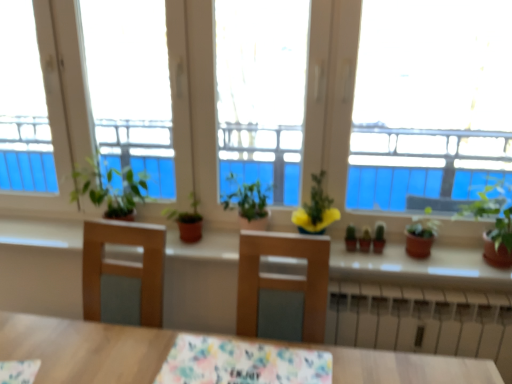
Find the location of a particular element. Image resolution: width=512 pixels, height=384 pixels. green matte plant at center, the 5th houseplant from the right is located at coordinates (187, 221).

Where is `matte brown pot at right, acting as the fourth houseplant starting from the left`? matte brown pot at right, acting as the fourth houseplant starting from the left is located at coordinates (421, 235).

What do you see at coordinates (350, 238) in the screenshot?
I see `green matte cactus at center, the 2th plant viewed from the right` at bounding box center [350, 238].

You are a GUI agent. You are given a task and a screenshot of the screen. Output one action in this format:
    pyautogui.click(x=<x>, y=<y>)
    Task: Click on the yellow matte flower pot at center, the third houseplant when ordered from left to right
    The image size is (512, 384).
    Given the screenshot: What is the action you would take?
    pyautogui.click(x=316, y=210)

Describe the element at coordinates (422, 321) in the screenshot. Image resolution: width=512 pixels, height=384 pixels. I see `white metallic radiator at lower center` at that location.

The width and height of the screenshot is (512, 384). Describe the element at coordinates (420, 268) in the screenshot. I see `beige concrete window sill at center` at that location.

Where is `floral fabric tablecloth at center`? This screenshot has width=512, height=384. floral fabric tablecloth at center is located at coordinates 241,362.

At what (x,y) coordinates should I click in order to perform the action: click on green matte plant at center, the 5th houseplant from the right. Please return your answer as a coordinate pair (x, y). Looking at the image, I should click on (187, 221).

Is white metallic radiator at lower center next to matte brown pot at right, which is the second houseplant from right to left, and touching it?

No.

How distant is white metallic radiator at lower center from matte brown pot at right, which is the second houseplant from right to left?

They are 29.70 centimeters apart.

From the image's perspective, which is below, white metallic radiator at lower center or matte brown pot at right, acting as the fourth houseplant starting from the left?

white metallic radiator at lower center is shown below in the image.

You are a GUI agent. You are given a task and a screenshot of the screen. Output one action in this format:
    pyautogui.click(x=<x>, y=<y>)
    Task: Click on the radiator below the matte brown pot at right, acting as the fourth houseplant starting from the left (from a real-world perspective)
    The width and height of the screenshot is (512, 384).
    Given the screenshot: What is the action you would take?
    pyautogui.click(x=422, y=321)

From the image's perspective, is green matte plant at center, the 5th houseplant from the right, above or below green matte plant at right, the fifth houseplant positioned from the left?

green matte plant at center, the 5th houseplant from the right, is below green matte plant at right, the fifth houseplant positioned from the left.

Starting from the green matte plant at center, the first houseplant when ordered from left to right, which houseplant is the 4th one in front? Please provide its 2D coordinates.

[(494, 225)]

What's the angular difference between green matte plant at center, the 5th houseplant from the right, and green matte plant at right, the fifth houseplant positioned from the left,'s facing directions?

The angular difference between green matte plant at center, the 5th houseplant from the right, and green matte plant at right, the fifth houseplant positioned from the left, is 9.6e-05 degrees.

Looking at this image, considering the relative sizes of green matte plant at center, the first houseplant when ordered from left to right, and green matte plant at right, the fifth houseplant positioned from the left, in the image provided, is green matte plant at center, the first houseplant when ordered from left to right, smaller than green matte plant at right, the fifth houseplant positioned from the left,?

Correct, green matte plant at center, the first houseplant when ordered from left to right, occupies less space than green matte plant at right, the fifth houseplant positioned from the left.

Considering the relative sizes of yellow matte flower pot at center, the third houseplant when ordered from left to right, and green matte plant at right, acting as the first houseplant starting from the right, in the image provided, is yellow matte flower pot at center, the third houseplant when ordered from left to right, wider than green matte plant at right, acting as the first houseplant starting from the right,?

Incorrect, the width of yellow matte flower pot at center, the third houseplant when ordered from left to right, does not surpass that of green matte plant at right, acting as the first houseplant starting from the right.

Is yellow matte flower pot at center, which ranks as the third houseplant in right-to-left order, not within green matte plant at right, the fifth houseplant positioned from the left?

yellow matte flower pot at center, which ranks as the third houseplant in right-to-left order, is positioned outside green matte plant at right, the fifth houseplant positioned from the left.

Based on the photo, from a real-world perspective, which is physically below, yellow matte flower pot at center, which ranks as the third houseplant in right-to-left order, or green matte plant at right, the fifth houseplant positioned from the left?

From a 3D spatial view, yellow matte flower pot at center, which ranks as the third houseplant in right-to-left order, is below.

Between yellow matte flower pot at center, which ranks as the third houseplant in right-to-left order, and green matte plant at right, acting as the first houseplant starting from the right, which one appears on the right side from the viewer's perspective?

Positioned to the right is green matte plant at right, acting as the first houseplant starting from the right.

Which of these two, green matte plant at center, which appears as the 2th plant when viewed from the left, or yellow matte flower pot at center, the third houseplant when ordered from left to right, is smaller?

Smaller between the two is green matte plant at center, which appears as the 2th plant when viewed from the left.

Considering the relative sizes of green matte plant at center, which appears as the 2th plant when viewed from the left, and yellow matte flower pot at center, which ranks as the third houseplant in right-to-left order, in the image provided, is green matte plant at center, which appears as the 2th plant when viewed from the left, wider than yellow matte flower pot at center, which ranks as the third houseplant in right-to-left order,?

Incorrect, the width of green matte plant at center, which appears as the 2th plant when viewed from the left, does not surpass that of yellow matte flower pot at center, which ranks as the third houseplant in right-to-left order.

In terms of height, does green matte plant at center, which is the 1th plant in right-to-left order, look taller or shorter compared to yellow matte flower pot at center, which ranks as the third houseplant in right-to-left order?

Considering their sizes, green matte plant at center, which is the 1th plant in right-to-left order, has less height than yellow matte flower pot at center, which ranks as the third houseplant in right-to-left order.

Between green matte plant at center, which is the 1th plant in right-to-left order, and yellow matte flower pot at center, which ranks as the third houseplant in right-to-left order, which one appears on the left side from the viewer's perspective?

yellow matte flower pot at center, which ranks as the third houseplant in right-to-left order, is more to the left.

Considering the sizes of objects floral fabric tablecloth at center and matte brown pot at right, acting as the fourth houseplant starting from the left, in the image provided, who is bigger, floral fabric tablecloth at center or matte brown pot at right, acting as the fourth houseplant starting from the left,?

floral fabric tablecloth at center.

Which is behind, point (268, 360) or point (428, 229)?

The point (428, 229) is farther.

From a real-world perspective, which object rests below the other?

floral fabric tablecloth at center, from a real-world perspective.

Considering the sizes of objects floral fabric tablecloth at center and matte brown pot at right, acting as the fourth houseplant starting from the left, in the image provided, who is wider, floral fabric tablecloth at center or matte brown pot at right, acting as the fourth houseplant starting from the left,?

Wider between the two is floral fabric tablecloth at center.

Which is correct: beige concrete window sill at center is inside transparent glass window at center, or outside of it?

beige concrete window sill at center is spatially situated outside transparent glass window at center.

Which of these two, beige concrete window sill at center or transparent glass window at center, is wider?

With larger width is beige concrete window sill at center.

Considering the sizes of beige concrete window sill at center and transparent glass window at center in the image, is beige concrete window sill at center taller or shorter than transparent glass window at center?

beige concrete window sill at center is shorter than transparent glass window at center.

Does white metallic radiator at lower center turn towards green matte plant at right, acting as the first houseplant starting from the right?

No, white metallic radiator at lower center is not turned towards green matte plant at right, acting as the first houseplant starting from the right.

Which is behind, point (357, 290) or point (486, 192)?

Positioned behind is point (486, 192).

Is white metallic radiator at lower center at the left side of green matte plant at right, acting as the first houseplant starting from the right?

Correct, you'll find white metallic radiator at lower center to the left of green matte plant at right, acting as the first houseplant starting from the right.

Based on the photo, would you say green matte plant at right, acting as the first houseplant starting from the right, is part of white metallic radiator at lower center's contents?

Answer: That's incorrect, green matte plant at right, acting as the first houseplant starting from the right, is not inside white metallic radiator at lower center.

Locate an element on the screen. The height and width of the screenshot is (384, 512). radiator on the right of the matte brown pot at right, acting as the fourth houseplant starting from the left is located at coordinates (422, 321).

You are a GUI agent. You are given a task and a screenshot of the screen. Output one action in this format:
    pyautogui.click(x=<x>, y=<y>)
    Task: Click on the 1st houseplant below when counting from the green matte plant at right, acting as the first houseplant starting from the right (from the image's perspective)
    This screenshot has width=512, height=384.
    Given the screenshot: What is the action you would take?
    pyautogui.click(x=187, y=221)

From the picture: From the image, which object appears to be farther from matte brown pot at right, which is the second houseplant from right to left, white metallic radiator at lower center or green matte plant at right, acting as the first houseplant starting from the right?

white metallic radiator at lower center lies further to matte brown pot at right, which is the second houseplant from right to left, than the other object.

From the image, which object appears to be farther from white metallic radiator at lower center, green matte plant at center, the first houseplant when ordered from left to right, or green matte plant at center, which is the 4th houseplant in right-to-left order?

green matte plant at center, the first houseplant when ordered from left to right, lies further to white metallic radiator at lower center than the other object.

Considering their positions, is green matte plant at center, which is the 1th plant in right-to-left order, positioned closer to yellow matte flower pot at center, the third houseplant when ordered from left to right, than white metallic radiator at lower center?

The object closer to yellow matte flower pot at center, the third houseplant when ordered from left to right, is green matte plant at center, which is the 1th plant in right-to-left order.

Considering their positions, is green matte cactus at center, marked as the 1th plant in a left-to-right arrangement, positioned further to green matte plant at right, acting as the first houseplant starting from the right, than yellow matte flower pot at center, which ranks as the third houseplant in right-to-left order?

yellow matte flower pot at center, which ranks as the third houseplant in right-to-left order.

Estimate the real-world distances between objects in this image. Which object is further from white metallic radiator at lower center, green matte plant at center, which is the 4th houseplant in right-to-left order, or yellow matte flower pot at center, the third houseplant when ordered from left to right?

Among the two, green matte plant at center, which is the 4th houseplant in right-to-left order, is located further to white metallic radiator at lower center.

Based on their spatial positions, is beige concrete window sill at center or green matte plant at right, the fifth houseplant positioned from the left, closer to green matte cactus at center, marked as the 1th plant in a left-to-right arrangement?

beige concrete window sill at center is positioned closer to the anchor green matte cactus at center, marked as the 1th plant in a left-to-right arrangement.

Looking at the image, which one is located closer to yellow matte flower pot at center, the third houseplant when ordered from left to right, matte brown pot at right, which is the second houseplant from right to left, or green matte plant at center, which appears as the 2th plant when viewed from the left?

Based on the image, green matte plant at center, which appears as the 2th plant when viewed from the left, appears to be nearer to yellow matte flower pot at center, the third houseplant when ordered from left to right.

When comparing their distances from white metallic radiator at lower center, does yellow matte flower pot at center, the third houseplant when ordered from left to right, or transparent glass window at center seem closer?

The object closer to white metallic radiator at lower center is yellow matte flower pot at center, the third houseplant when ordered from left to right.

The height and width of the screenshot is (384, 512). What are the coordinates of `radiator located between floral fabric tablecloth at center and green matte cactus at center, the 2th plant viewed from the right, in the depth direction` in the screenshot? It's located at tap(422, 321).

At what (x,y) coordinates should I click in order to perform the action: click on radiator between transparent glass window at center and green matte plant at right, acting as the first houseplant starting from the right, from left to right. Please return your answer as a coordinate pair (x, y). Looking at the image, I should click on (422, 321).

I want to click on plant between green matte cactus at center, the 2th plant viewed from the right, and white metallic radiator at lower center, in the vertical direction, so click(379, 238).

Where is `window between beige concrete window sill at center and green matte cactus at center, marked as the 1th plant in a left-to-right arrangement, in the horizontal direction`? This screenshot has width=512, height=384. window between beige concrete window sill at center and green matte cactus at center, marked as the 1th plant in a left-to-right arrangement, in the horizontal direction is located at coordinates (395, 93).